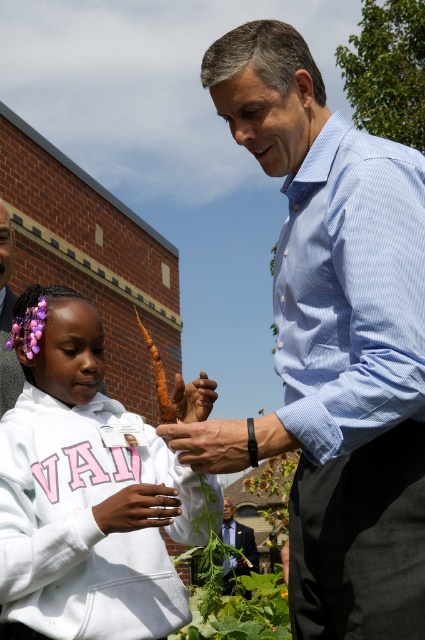
Is point (133, 524) farther from camera compared to point (244, 572)?

No, it is not.

Which is in front, point (116, 513) or point (231, 525)?

Positioned in front is point (116, 513).

At what (x,y) coordinates should I click in order to perform the action: click on dark skin hand at lower left. Please return your answer as a coordinate pair (x, y). This screenshot has height=640, width=425. Looking at the image, I should click on (136, 508).

Measure the distance between white matte hoodie at center and camera.

The distance of white matte hoodie at center from camera is 15.66 feet.

Which is above, white matte hoodie at center or dark blue shirt at center?

white matte hoodie at center is higher up.

Locate an element on the screen. The width and height of the screenshot is (425, 640). white matte hoodie at center is located at coordinates (87, 496).

Who is more forward, (249, 572) or (209, 387)?

Positioned in front is point (209, 387).

Is dark blue shirt at center below brown leather hand at center?

Correct, dark blue shirt at center is located below brown leather hand at center.

Image resolution: width=425 pixels, height=640 pixels. Find the location of `dark blue shirt at center`. dark blue shirt at center is located at coordinates (238, 534).